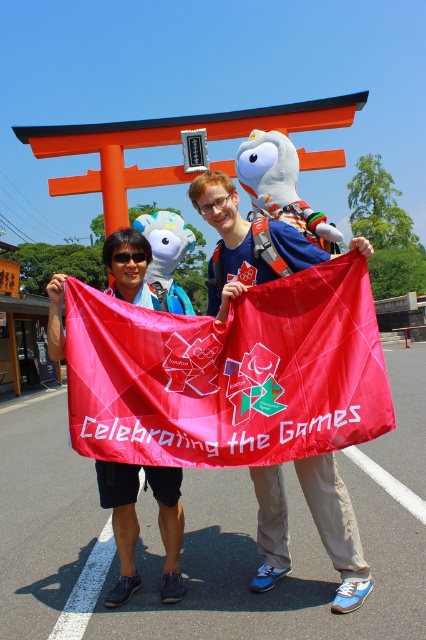
In the scene shown: You are standing in the park and see the matte fabric flag at center. If you want to reach the flag, how many steps would you need to take if each step is about 3 feet long?

The distance between you and the matte fabric flag at center is 9.47 feet. Since each step is 3 feet, you would need to take approximately 3 steps to reach the flag.

You are a photographer taking a photo of the matte pink flag at center and the white plush toy at center. Which object should you focus on first if you want to capture both in the frame without moving the camera?

The matte pink flag at center is taller than the white plush toy at center, so you should focus on the taller matte pink flag at center first to ensure it fits within the frame.